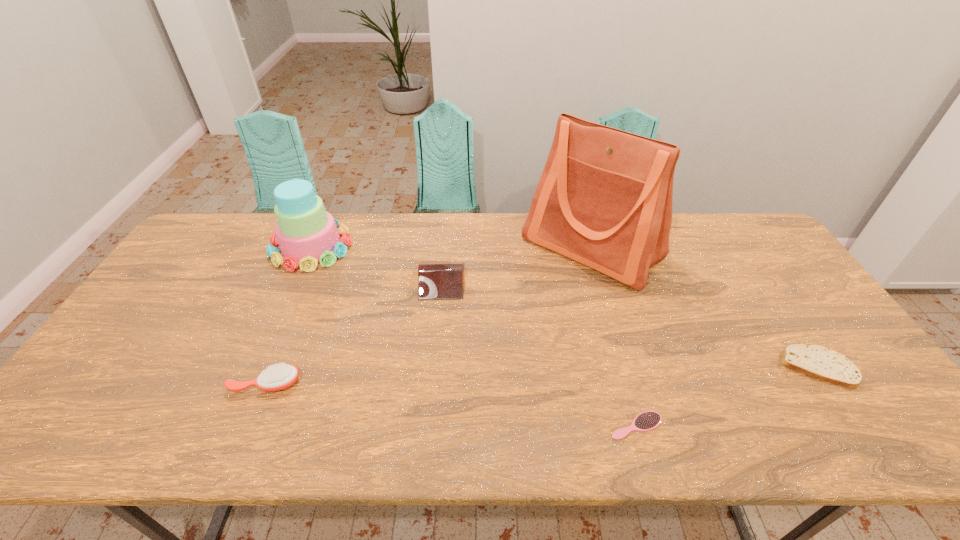
This screenshot has height=540, width=960. Identify the location of shopping bag. (604, 199).

Locate an element on the screen. the fifth shortest object is located at coordinates (307, 234).

Find the location of `the third object from left to right`. the third object from left to right is located at coordinates (436, 279).

What are the coordinates of `book` in the screenshot? It's located at (436, 279).

The image size is (960, 540). I want to click on the third shortest object, so click(x=277, y=377).

At what (x,y) coordinates should I click in order to perform the action: click on the farther hairbrush. Please return your answer as a coordinate pair (x, y). Looking at the image, I should click on (277, 377).

Image resolution: width=960 pixels, height=540 pixels. Identify the location of the second shortest object. (816, 361).

Find the location of a particular element. the rightmost object is located at coordinates pyautogui.click(x=816, y=361).

Locate an element on the screen. the nearer hairbrush is located at coordinates (646, 421).

The height and width of the screenshot is (540, 960). Find the location of `the nearest object`. the nearest object is located at coordinates (646, 421).